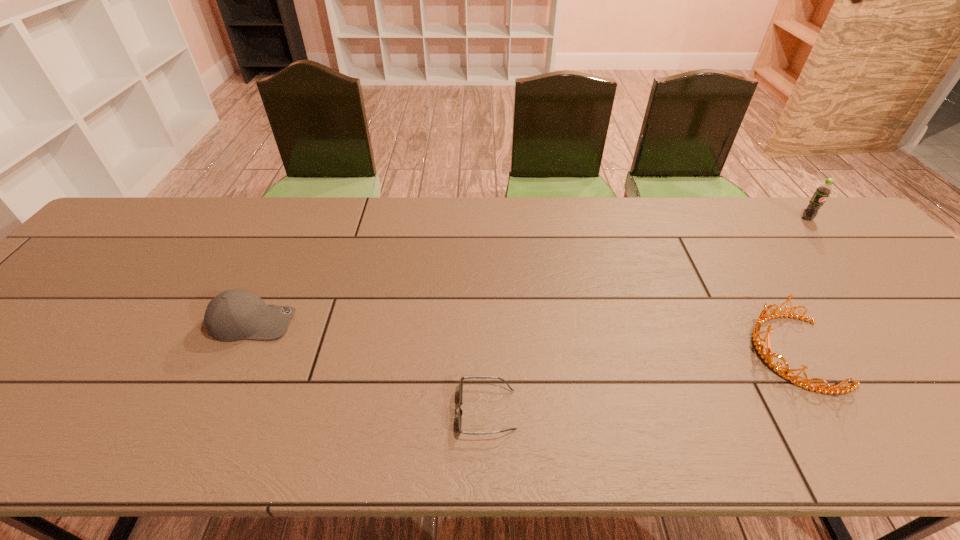
This screenshot has height=540, width=960. In order to click on free location located 0.140m on the front brim of the baseball cap in this screenshot , I will do `click(353, 322)`.

Where is `vacant space located on the front-facing side of the sunglasses`? The width and height of the screenshot is (960, 540). vacant space located on the front-facing side of the sunglasses is located at coordinates (395, 410).

Where is `vacant space located 0.380m on the front-facing side of the sunglasses`? Image resolution: width=960 pixels, height=540 pixels. vacant space located 0.380m on the front-facing side of the sunglasses is located at coordinates (272, 410).

This screenshot has height=540, width=960. What are the coordinates of `free space located 0.260m on the front-facing side of the sunglasses` in the screenshot? It's located at (331, 410).

The height and width of the screenshot is (540, 960). What are the coordinates of `object that is positioned at the far edge` in the screenshot? It's located at (822, 192).

At what (x,y) coordinates should I click in order to perform the action: click on object located at the near edge. Please return your answer as a coordinate pair (x, y). Image resolution: width=960 pixels, height=540 pixels. Looking at the image, I should click on (460, 412).

You are a GUI agent. You are given a task and a screenshot of the screen. Output one action in this format:
    pyautogui.click(x=<x>, y=<y>)
    Task: Click on the object that is at the right edge
    The height and width of the screenshot is (540, 960).
    Given the screenshot: What is the action you would take?
    pyautogui.click(x=822, y=192)

You are a GUI agent. You are given a task and a screenshot of the screen. Output one action in this format:
    pyautogui.click(x=<x>, y=<y>)
    Task: Click on the object present at the far right corner
    Image resolution: width=960 pixels, height=540 pixels.
    Given the screenshot: What is the action you would take?
    pyautogui.click(x=822, y=192)

You are a GUI agent. You are given a task and a screenshot of the screen. Output one action in this format:
    pyautogui.click(x=<x>, y=<y>)
    Task: Click on the vacant space at the far edge of the desktop
    This screenshot has width=960, height=540.
    Given the screenshot: What is the action you would take?
    pyautogui.click(x=443, y=244)

Where is `free region at the left edge of the desktop`? This screenshot has height=540, width=960. free region at the left edge of the desktop is located at coordinates (68, 276).